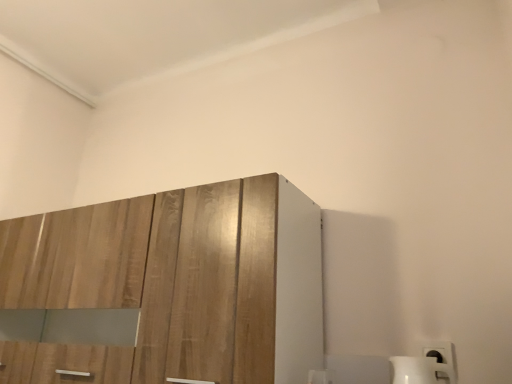
This screenshot has height=384, width=512. What do you see at coordinates (186, 276) in the screenshot?
I see `wooden cabinet at upper left` at bounding box center [186, 276].

Identify the location of wooden cabinet at upper left. This screenshot has width=512, height=384. (186, 276).

Image resolution: width=512 pixels, height=384 pixels. What are the coordinates of `wooden cabinet at upper left` in the screenshot? It's located at (186, 276).